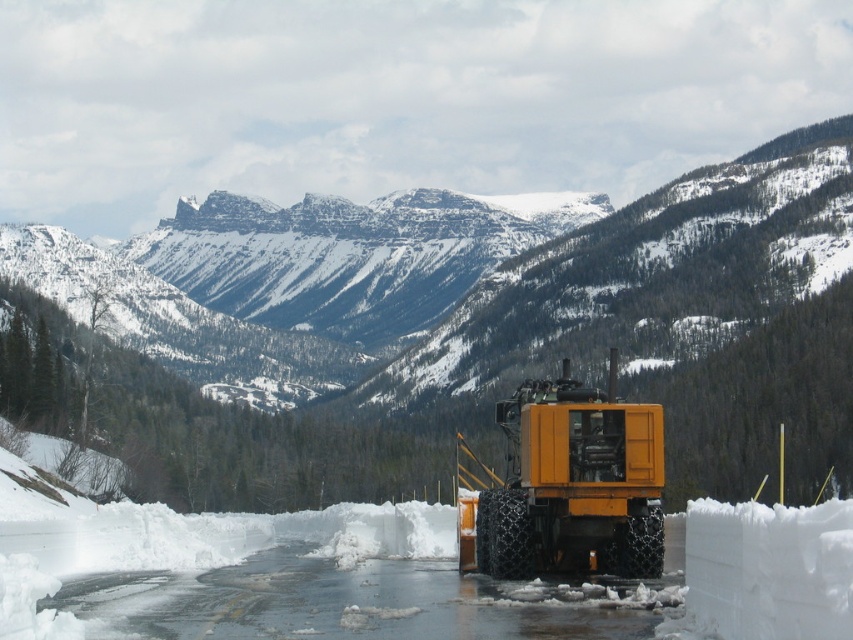
Image resolution: width=853 pixels, height=640 pixels. Describe the element at coordinates (461, 330) in the screenshot. I see `snowy rock mountain at center` at that location.

Does snowy rock mountain at center have a greater height compared to yellow matte forklift at center?

Yes.

Is point (685, 406) more distant than point (630, 458)?

Yes, point (685, 406) is behind point (630, 458).

Image resolution: width=853 pixels, height=640 pixels. I want to click on snowy rock mountain at center, so 461,330.